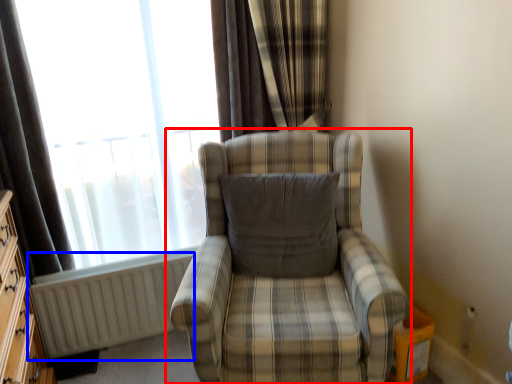
Question: Which object appears closest to the camera in this image, chair (highlighted by a red box) or radiator (highlighted by a blue box)?

Choices:
 (A) chair
 (B) radiator

Answer: (A)